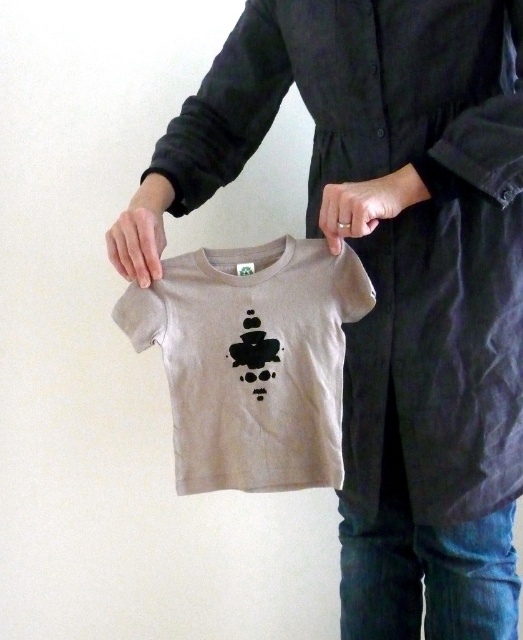
Question: Does matte black hand at center appear under smooth beige hand at center?

Choices:
 (A) no
 (B) yes

Answer: (A)

Question: Does light beige cotton t-shirt at center have a lesser width compared to smooth beige hand at center?

Choices:
 (A) no
 (B) yes

Answer: (A)

Question: Which of the following is the closest to the observer?

Choices:
 (A) (371, 198)
 (B) (165, 186)
 (C) (267, 284)

Answer: (A)

Question: Which object is the closest to the smooth beige hand at center?

Choices:
 (A) light beige cotton t-shirt at center
 (B) matte black hand at center

Answer: (A)

Question: Which point is farther to the camera?

Choices:
 (A) (138, 260)
 (B) (128, 336)
 (C) (382, 212)

Answer: (B)

Question: Is light beige cotton t-shirt at center further to the viewer compared to smooth beige hand at center?

Choices:
 (A) no
 (B) yes

Answer: (B)